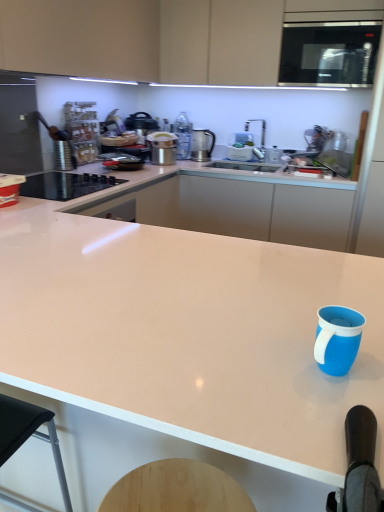
Where is `free space in front of blue matte mug at lower right`? This screenshot has height=512, width=384. free space in front of blue matte mug at lower right is located at coordinates (323, 417).